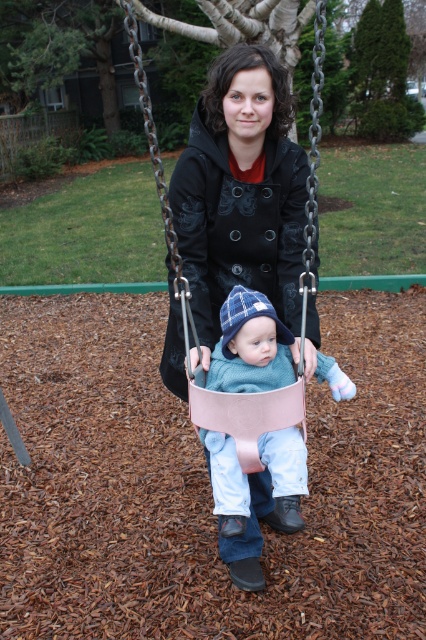
Does pink leather swing at center have a greater width compared to light blue knit sweater at center?

Yes.

Which is behind, point (258, 92) or point (270, 326)?

Positioned behind is point (258, 92).

Locate an element on the screen. Image resolution: width=426 pixels, height=640 pixels. pink leather swing at center is located at coordinates (244, 189).